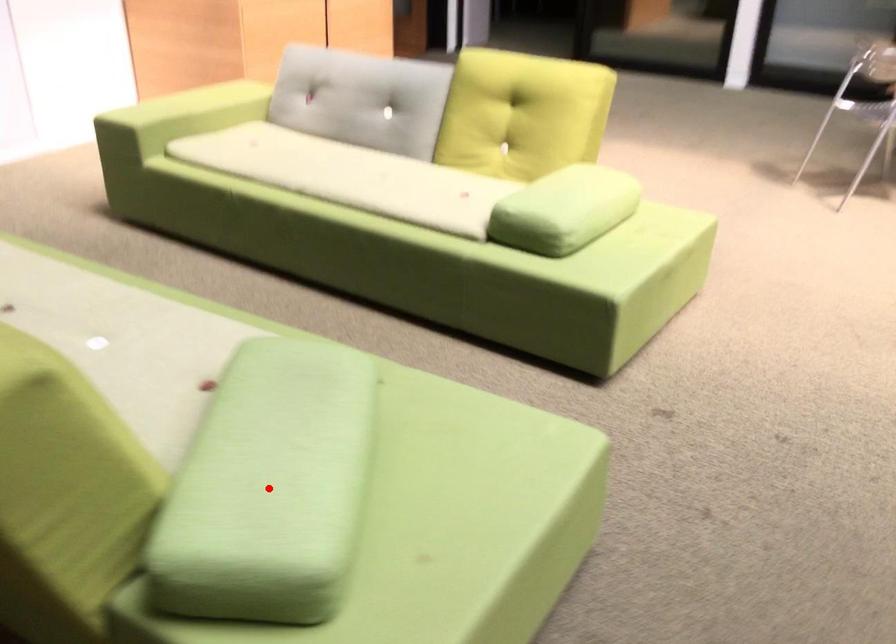
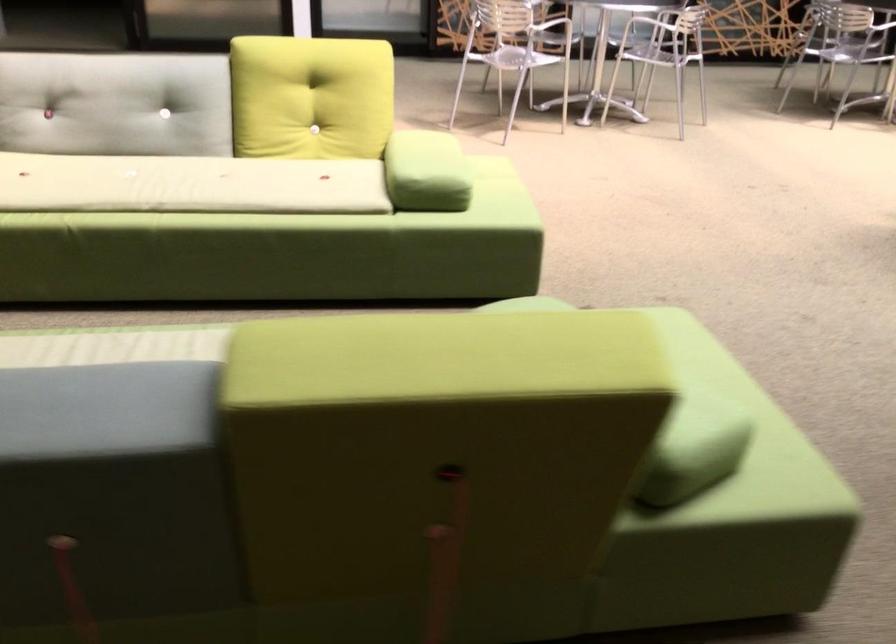
Question: I am providing you with two images of the same scene from different viewpoints. A red point is marked on the first image. Can you still see the location of the red point in image 2?

Choices:
 (A) Yes
 (B) No

Answer: (B)